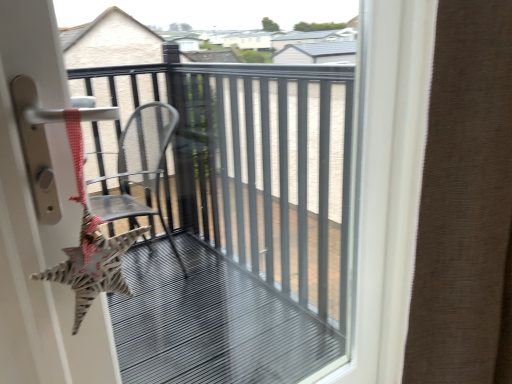
Question: Can you see brown textured curtain at right touching metallic gray chair at center?

Choices:
 (A) no
 (B) yes

Answer: (A)

Question: Is brown textured curtain at right oriented away from metallic gray chair at center?

Choices:
 (A) yes
 (B) no

Answer: (B)

Question: Can you confirm if brown textured curtain at right is shorter than metallic gray chair at center?

Choices:
 (A) yes
 (B) no

Answer: (A)

Question: From a real-world perspective, is brown textured curtain at right located higher than metallic gray chair at center?

Choices:
 (A) no
 (B) yes

Answer: (B)

Question: Is the depth of brown textured curtain at right less than that of metallic gray chair at center?

Choices:
 (A) no
 (B) yes

Answer: (B)

Question: Would you say brown textured curtain at right is a long distance from metallic gray chair at center?

Choices:
 (A) no
 (B) yes

Answer: (A)

Question: Does metallic gray chair at center lie behind brown textured curtain at right?

Choices:
 (A) no
 (B) yes

Answer: (B)

Question: Does metallic gray chair at center have a greater height compared to brown textured curtain at right?

Choices:
 (A) yes
 (B) no

Answer: (A)

Question: From a real-world perspective, is metallic gray chair at center positioned over brown textured curtain at right based on gravity?

Choices:
 (A) yes
 (B) no

Answer: (B)

Question: Is metallic gray chair at center facing away from brown textured curtain at right?

Choices:
 (A) no
 (B) yes

Answer: (A)

Question: Is metallic gray chair at center far away from brown textured curtain at right?

Choices:
 (A) yes
 (B) no

Answer: (B)

Question: Can you confirm if metallic gray chair at center is smaller than brown textured curtain at right?

Choices:
 (A) yes
 (B) no

Answer: (A)

Question: From a real-world perspective, is metallic gray chair at center positioned above or below brown textured curtain at right?

Choices:
 (A) above
 (B) below

Answer: (B)